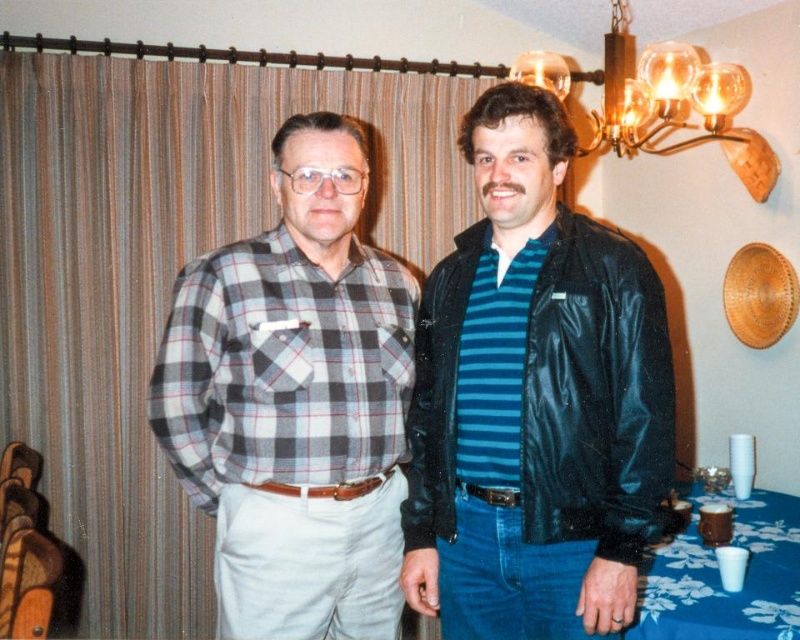
Question: Which point is closer to the camera taking this photo?

Choices:
 (A) (281, 250)
 (B) (774, 516)
 (C) (601, 124)
 (D) (564, 336)

Answer: (D)

Question: Which point appears farthest from the camera in this image?

Choices:
 (A) (717, 83)
 (B) (348, 492)
 (C) (600, 326)
 (D) (482, 132)

Answer: (A)

Question: Observing the image, what is the correct spatial positioning of plaid cotton shirt at center in reference to gold metallic chandelier at upper center?

Choices:
 (A) right
 (B) left

Answer: (B)

Question: Which of these objects is positioned farthest from the blue floral tablecloth at lower right?

Choices:
 (A) plaid cotton shirt at center
 (B) plaid flannel shirt at center
 (C) black shiny leather jacket at right
 (D) gold metallic chandelier at upper center

Answer: (D)

Question: Can you confirm if plaid cotton shirt at center is smaller than black shiny leather jacket at right?

Choices:
 (A) yes
 (B) no

Answer: (B)

Question: Is plaid cotton shirt at center wider than blue floral tablecloth at lower right?

Choices:
 (A) yes
 (B) no

Answer: (B)